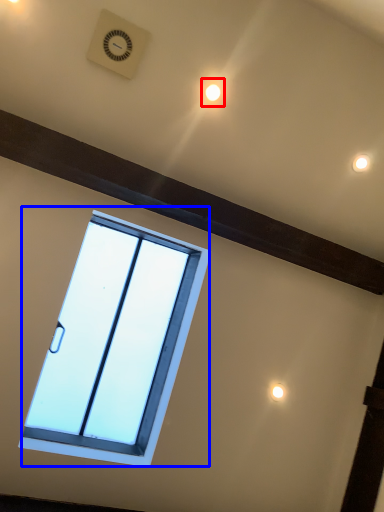
Question: Which object is further to the camera taking this photo, light (highlighted by a red box) or window (highlighted by a blue box)?

Choices:
 (A) light
 (B) window

Answer: (A)